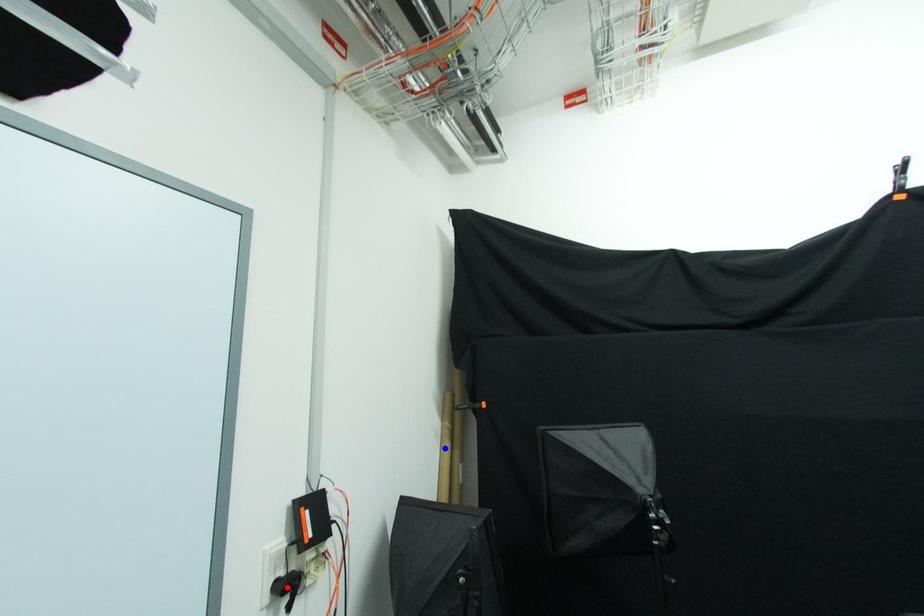
Question: Which of the two points in the image is closer to the camera?

Choices:
 (A) Blue point is closer.
 (B) Red point is closer.

Answer: (B)